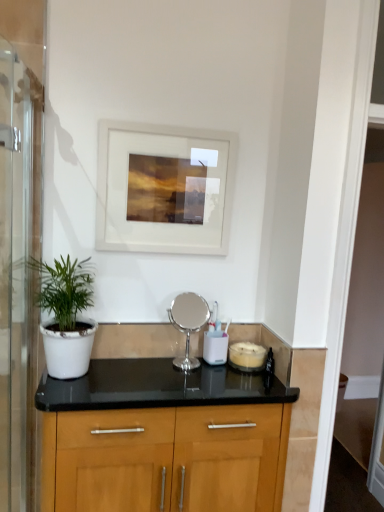
Question: In the image, is transparent glass screen door at left positioned in front of or behind white matte pot at left?

Choices:
 (A) front
 (B) behind

Answer: (A)

Question: Does point (26, 172) appear closer or farther from the camera than point (87, 292)?

Choices:
 (A) farther
 (B) closer

Answer: (B)

Question: Which object is positioned farthest from the white matte pot at left?

Choices:
 (A) silver metallic mirror at center, which is the 1th appliance in left-to-right order
 (B) white matte picture frame at upper center
 (C) white glossy candle at center, which is counted as the 2th appliance, starting from the left
 (D) transparent glass screen door at left

Answer: (C)

Question: Estimate the real-world distances between objects in this image. Which object is closer to the white matte pot at left?

Choices:
 (A) transparent glass screen door at left
 (B) silver metallic mirror at center, which is the 1th appliance in left-to-right order
 (C) white matte picture frame at upper center
 (D) white glossy candle at center, placed as the first appliance when sorted from right to left

Answer: (A)